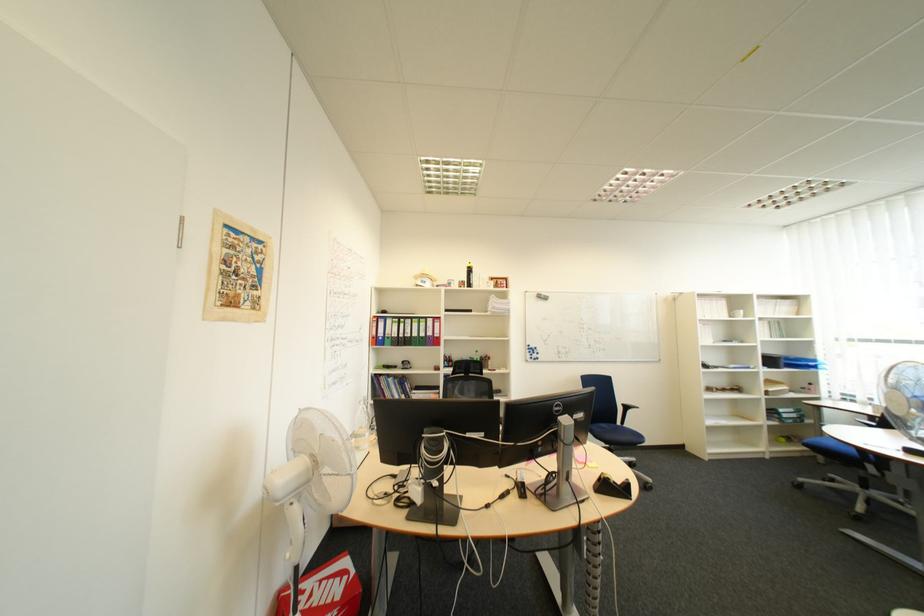
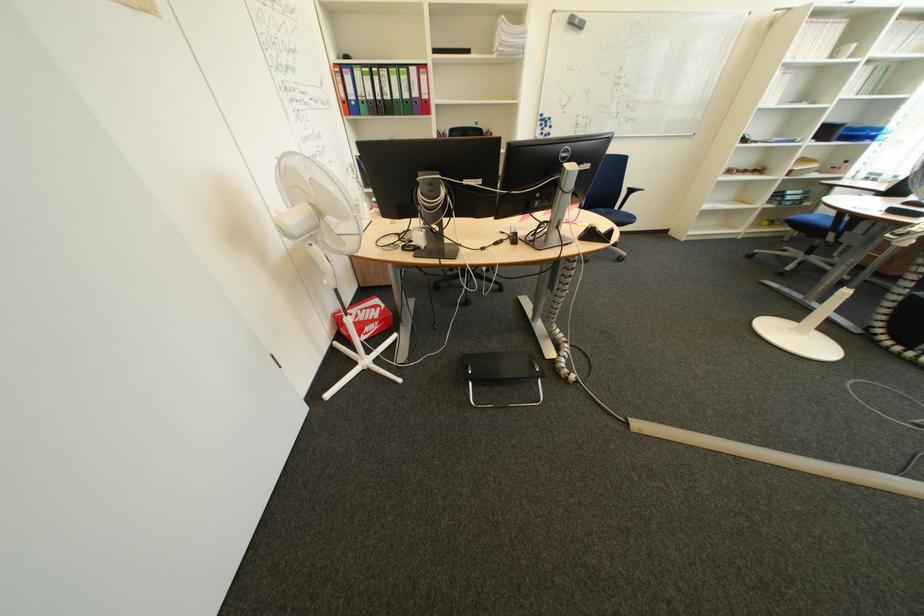
The point at (481,436) is marked in the first image. Where is the corresponding point in the second image?

(479, 184)